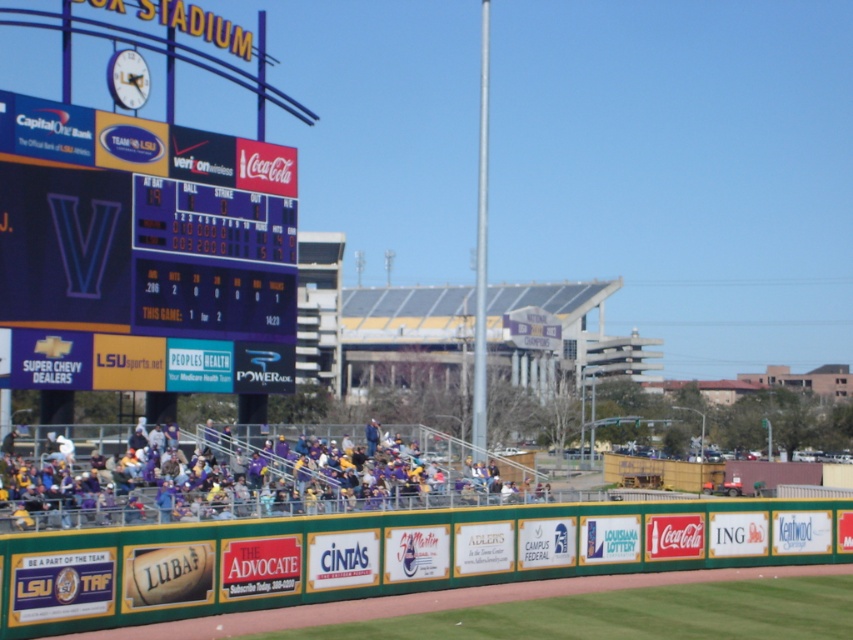
Is purple glossy scoreboard at left shorter than purple jersey at center?

No, purple glossy scoreboard at left is not shorter than purple jersey at center.

Where is `purple glossy scoreboard at left`? Image resolution: width=853 pixels, height=640 pixels. purple glossy scoreboard at left is located at coordinates (143, 252).

Find the location of a particular element. The width and height of the screenshot is (853, 640). purple glossy scoreboard at left is located at coordinates (143, 252).